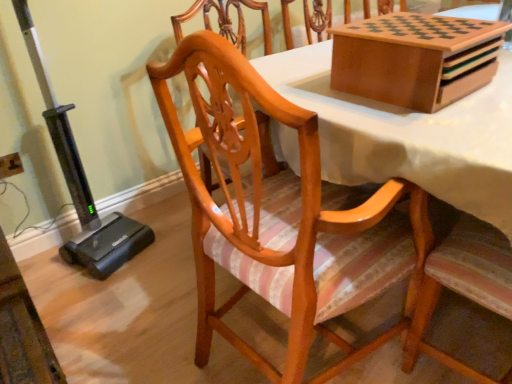
Question: Is matte wood chair at center turned away from wooden game board at upper right?

Choices:
 (A) yes
 (B) no

Answer: (B)

Question: Is matte wood chair at center facing towards wooden game board at upper right?

Choices:
 (A) no
 (B) yes

Answer: (B)

Question: Is matte wood chair at center outside wooden game board at upper right?

Choices:
 (A) yes
 (B) no

Answer: (A)

Question: Is the position of matte wood chair at center less distant than that of wooden game board at upper right?

Choices:
 (A) no
 (B) yes

Answer: (B)

Question: Is matte wood chair at center at the right side of wooden game board at upper right?

Choices:
 (A) no
 (B) yes

Answer: (A)

Question: Are matte wood chair at center and wooden game board at upper right beside each other?

Choices:
 (A) no
 (B) yes

Answer: (A)

Question: Can you confirm if wooden game board at upper right is wider than matte wood chair at center?

Choices:
 (A) no
 (B) yes

Answer: (A)

Question: Is wooden game board at upper right not inside matte wood chair at center?

Choices:
 (A) no
 (B) yes

Answer: (B)

Question: Is wooden game board at upper right positioned behind matte wood chair at center?

Choices:
 (A) yes
 (B) no

Answer: (A)

Question: Can you confirm if wooden game board at upper right is positioned to the right of matte wood chair at center?

Choices:
 (A) yes
 (B) no

Answer: (A)

Question: Considering the relative sizes of wooden game board at upper right and matte wood chair at center in the image provided, is wooden game board at upper right bigger than matte wood chair at center?

Choices:
 (A) yes
 (B) no

Answer: (B)

Question: From the image's perspective, is wooden game board at upper right under matte wood chair at center?

Choices:
 (A) yes
 (B) no

Answer: (B)

Question: In the image, is wooden game board at upper right positioned in front of or behind matte wood chair at center?

Choices:
 (A) behind
 (B) front

Answer: (A)